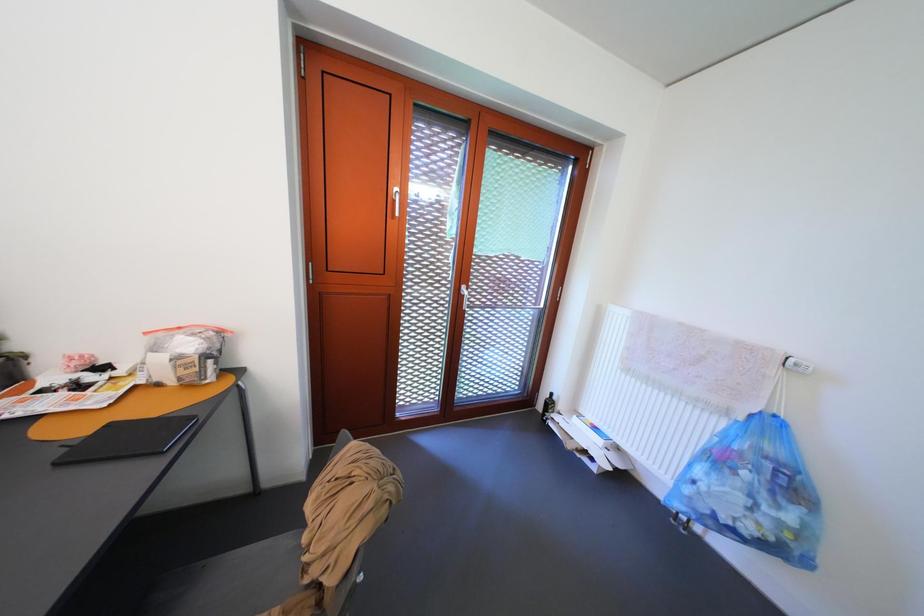
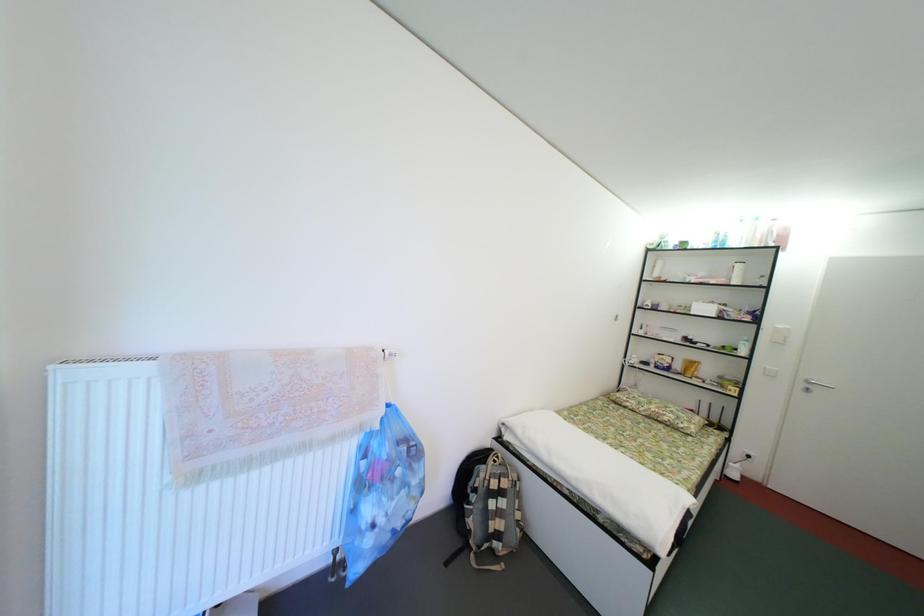
The images are taken continuously from a first-person perspective. In which direction is your viewpoint rotating?

The camera's rotation is toward right-down.